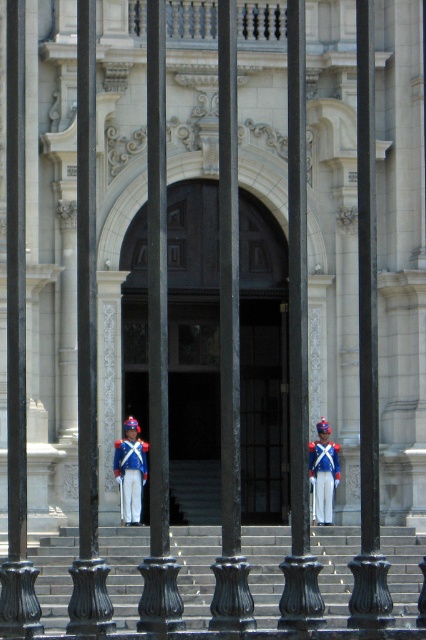
Question: Is gray concrete stairs at center thinner than black metal pole at center?

Choices:
 (A) yes
 (B) no

Answer: (B)

Question: Which of the following is the farthest from the observer?

Choices:
 (A) black wrought iron pole at center
 (B) black metal pole at center

Answer: (A)

Question: Which object appears farthest from the camera in this image?

Choices:
 (A) gray concrete stairs at center
 (B) black wrought iron pole at center
 (C) blue fabric uniform at center
 (D) black metal pole at center

Answer: (C)

Question: From the image, what is the correct spatial relationship of gray concrete stairs at center in relation to blue fabric uniform at center?

Choices:
 (A) above
 (B) below

Answer: (B)

Question: Which point is farther to the camera?

Choices:
 (A) pyautogui.click(x=293, y=179)
 (B) pyautogui.click(x=420, y=584)

Answer: (B)

Question: Does black wrought iron pole at center have a larger size compared to blue glossy uniform at center?

Choices:
 (A) yes
 (B) no

Answer: (A)